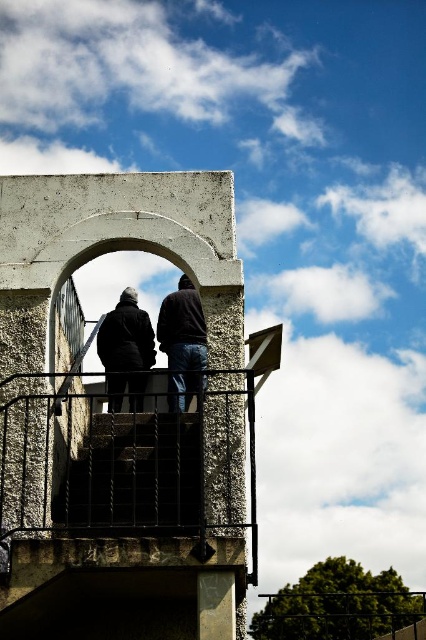
Question: Can you confirm if rustic concrete balcony at center is positioned below dark blue jeans at center?

Choices:
 (A) yes
 (B) no

Answer: (A)

Question: Is the position of dark brown leather jacket at center less distant than that of dark matte jacket at center?

Choices:
 (A) no
 (B) yes

Answer: (A)

Question: Which of the following is the farthest from the observer?

Choices:
 (A) (158, 518)
 (B) (186, 340)
 (C) (198, 369)
 (D) (48, 426)

Answer: (B)

Question: Which point is closer to the camera?

Choices:
 (A) dark matte jacket at center
 (B) dark blue jeans at center

Answer: (B)

Question: Is black metal stairwell at center to the left of dark matte jacket at center from the viewer's perspective?

Choices:
 (A) no
 (B) yes

Answer: (A)

Question: Which object is the closest to the dark blue jeans at center?

Choices:
 (A) dark brown leather jacket at center
 (B) rustic concrete balcony at center

Answer: (A)